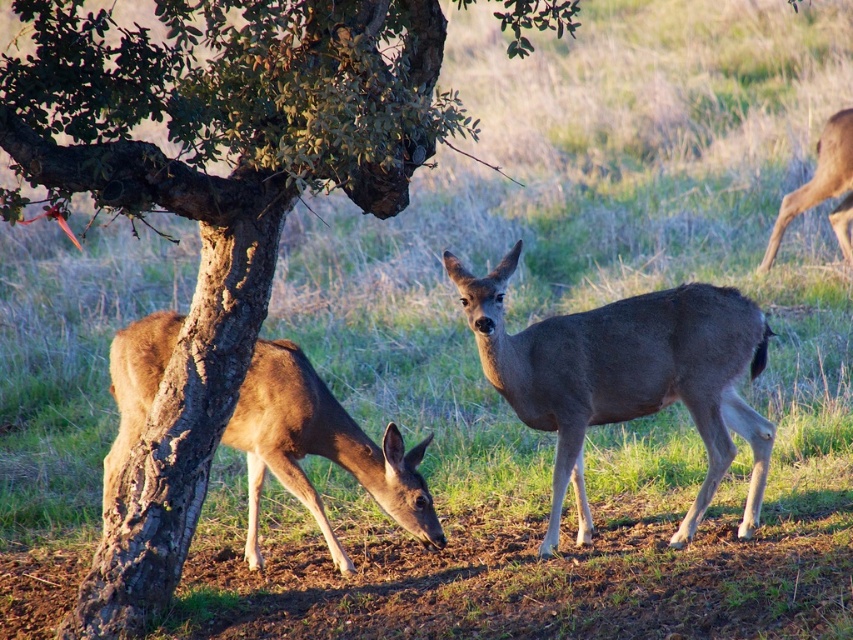
Does smooth bark tree at center have a larger size compared to brown fur deer at lower left?

Yes.

Locate an element on the screen. This screenshot has height=640, width=853. smooth bark tree at center is located at coordinates (213, 195).

Is point (282, 365) closer to viewer compared to point (833, 120)?

Yes, it is.

Is point (306, 429) more distant than point (838, 177)?

No, it is in front of (838, 177).

Image resolution: width=853 pixels, height=640 pixels. In order to click on brown fur deer at lower left in this screenshot , I will do `click(318, 449)`.

This screenshot has width=853, height=640. What are the coordinates of `brown fur deer at lower left` in the screenshot? It's located at (318, 449).

Image resolution: width=853 pixels, height=640 pixels. What do you see at coordinates (213, 195) in the screenshot?
I see `smooth bark tree at center` at bounding box center [213, 195].

Between smooth bark tree at center and gray matte deer at center, which one is positioned higher?

smooth bark tree at center is above.

The width and height of the screenshot is (853, 640). What do you see at coordinates (213, 195) in the screenshot?
I see `smooth bark tree at center` at bounding box center [213, 195].

The height and width of the screenshot is (640, 853). I want to click on smooth bark tree at center, so click(213, 195).